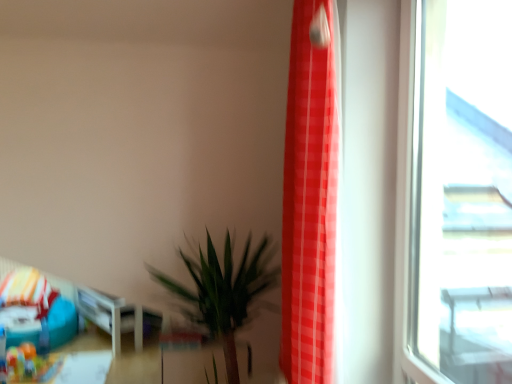
Question: From the image's perspective, relative to teal fabric bean bag at lower left, is transparent glass window at right above or below?

Choices:
 (A) above
 (B) below

Answer: (A)

Question: Is point (501, 6) positioned closer to the camera than point (22, 268)?

Choices:
 (A) farther
 (B) closer

Answer: (B)

Question: Estimate the real-world distances between objects in this image. Which object is farther from the teal fabric bean bag at lower left?

Choices:
 (A) red checkered curtain at right
 (B) green leafy plant at lower center
 (C) transparent glass window at right

Answer: (C)

Question: Considering the real-world distances, which object is farthest from the red checkered curtain at right?

Choices:
 (A) green leafy plant at lower center
 (B) teal fabric bean bag at lower left
 (C) transparent glass window at right

Answer: (B)